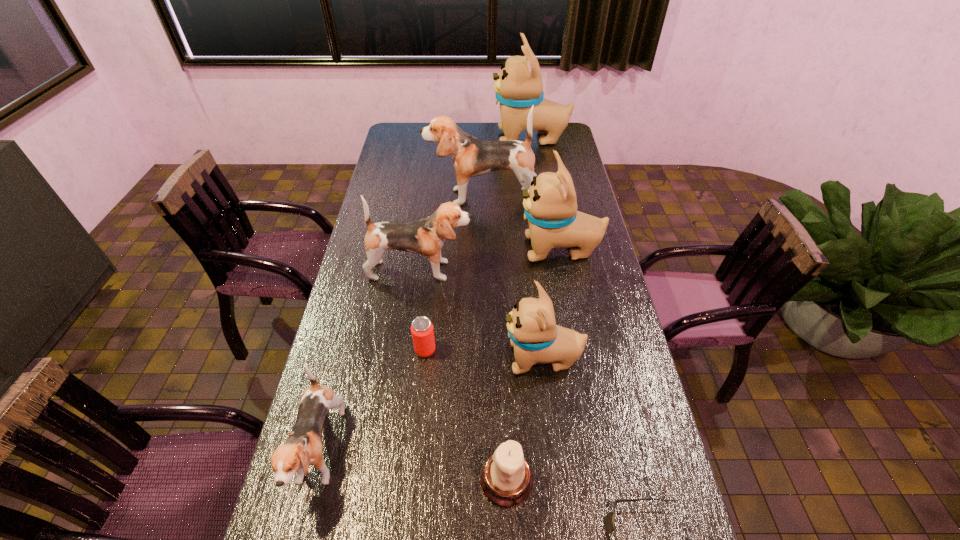
Find the location of `object that is at the far right corner`. object that is at the far right corner is located at coordinates (518, 87).

Find the location of a particular element. This screenshot has width=960, height=540. vacant space at the left edge is located at coordinates (372, 208).

This screenshot has width=960, height=540. In order to click on vacant region at the right edge of the desktop in this screenshot , I will do click(x=632, y=459).

In order to click on vacant space at the far right corner of the desktop in this screenshot , I will do `click(567, 140)`.

Find the location of a particular element. free spot between the nearest puppy and the nearest beige puppy is located at coordinates (431, 407).

Locate an element on the screen. This screenshot has width=960, height=540. empty location between the second farthest puppy and the fifth farthest puppy is located at coordinates (512, 278).

At what (x,y) coordinates should I click in order to perform the action: click on free spot between the nearest beige puppy and the nearest puppy. Please return your answer as a coordinate pair (x, y). The height and width of the screenshot is (540, 960). Looking at the image, I should click on (431, 407).

This screenshot has width=960, height=540. I want to click on vacant space in between the candle holder and the second shortest object, so click(466, 415).

Locate an element on the screen. The height and width of the screenshot is (540, 960). object that is the seventh closest one to the fifth nearest puppy is located at coordinates (506, 478).

Where is `the third closest object relative to the shortest object`? Image resolution: width=960 pixels, height=540 pixels. the third closest object relative to the shortest object is located at coordinates (422, 331).